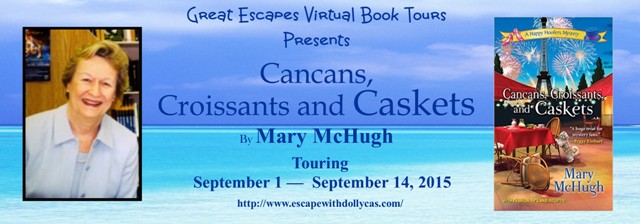
I want to click on wooden wall panel, so click(x=45, y=89).